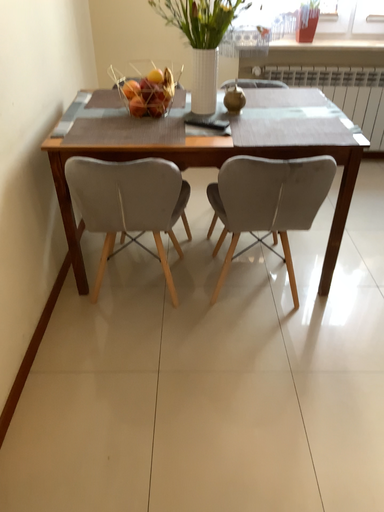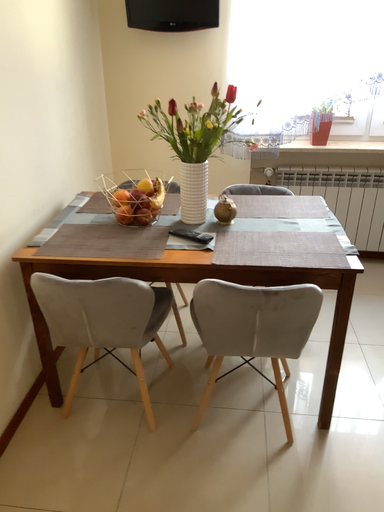
Question: How did the camera likely rotate when shooting the video?

Choices:
 (A) rotated downward
 (B) rotated upward

Answer: (B)